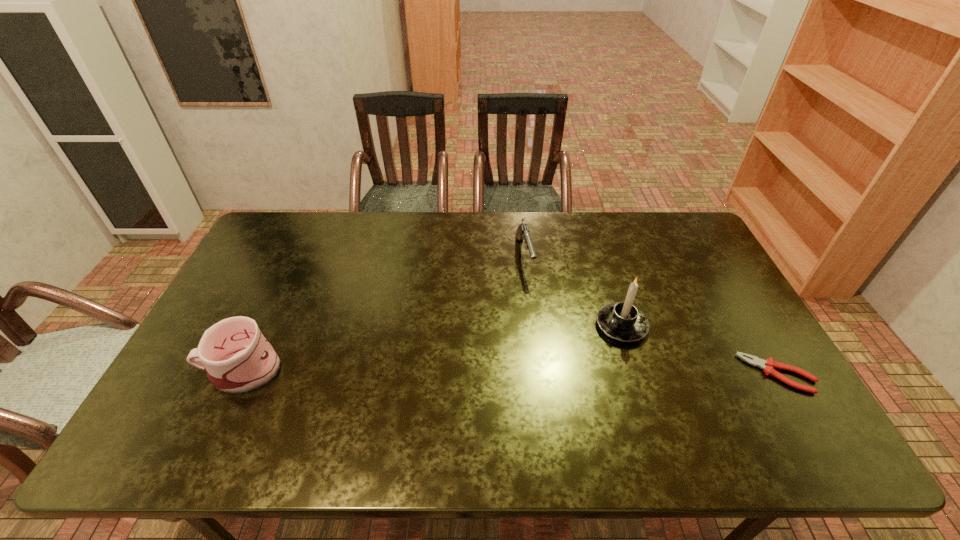
I want to click on vacant space located with a handle on the side of the second object from right to left, so click(x=521, y=397).

The width and height of the screenshot is (960, 540). Identify the location of free space located 0.270m with a handle on the side of the second object from right to left. (533, 389).

Find the location of a particular element. free space located 0.110m with a handle on the side of the second object from right to left is located at coordinates (577, 357).

At what (x,y) coordinates should I click in order to perform the action: click on free space located 0.060m aiming along the barrel of the gun. Please return your answer as a coordinate pair (x, y). Looking at the image, I should click on (531, 294).

Locate an element on the screen. This screenshot has height=540, width=960. vacant space positioned 0.180m aiming along the barrel of the gun is located at coordinates (540, 323).

You are a GUI agent. You are given a task and a screenshot of the screen. Output one action in this format:
    pyautogui.click(x=<x>, y=<y>)
    Task: Click on the vacant space located 0.160m aiming along the barrel of the gun
    This screenshot has width=960, height=540.
    Given the screenshot: What is the action you would take?
    pyautogui.click(x=538, y=318)

Identify the location of object that is at the far edge. The image size is (960, 540). (522, 232).

In order to click on mug at the near edge in this screenshot , I will do [x=237, y=357].

The height and width of the screenshot is (540, 960). Find the location of `pliers that is at the near edge`. pliers that is at the near edge is located at coordinates tap(768, 365).

At what (x,y) coordinates should I click in order to perform the action: click on object that is positioned at the left edge. Please return your answer as a coordinate pair (x, y). The image size is (960, 540). Looking at the image, I should click on (237, 357).